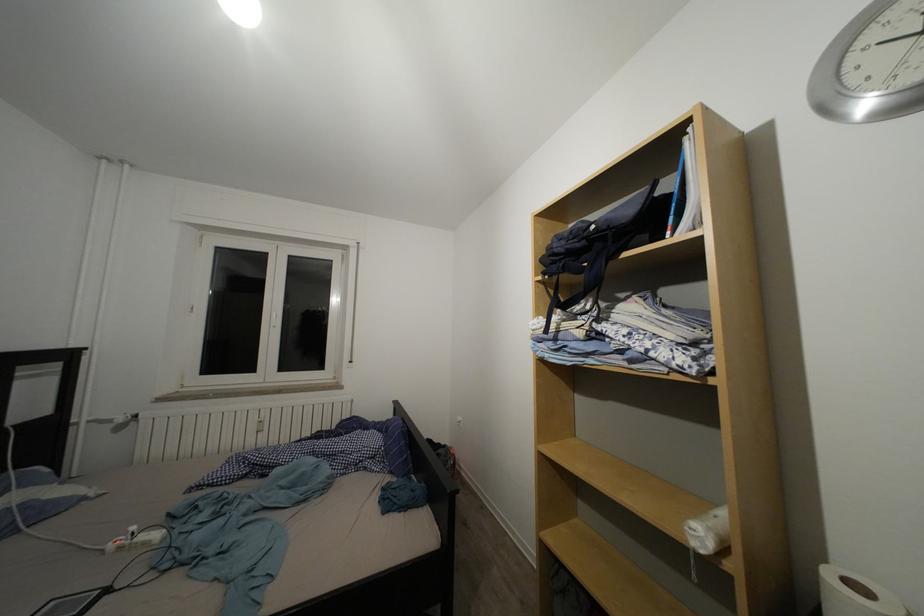
You are a GUI agent. You are given a task and a screenshot of the screen. Output one action in this format:
    pyautogui.click(x=<x>, y=<y>)
    Task: Click on the toilet paper roll
    The height and width of the screenshot is (616, 924).
    Given the screenshot: What is the action you would take?
    pyautogui.click(x=854, y=594)